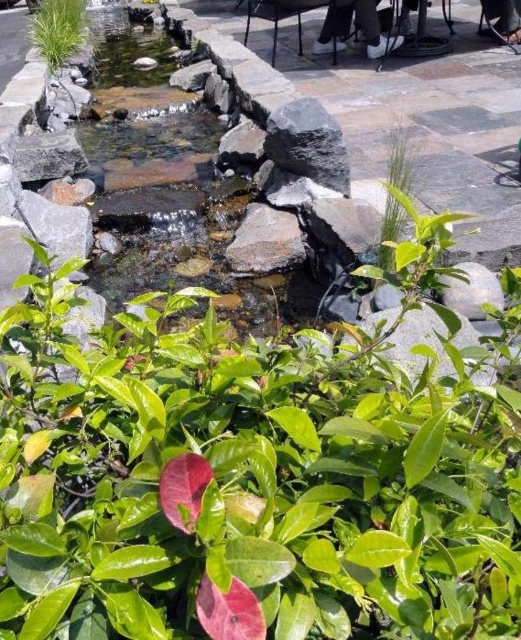
You are standing at the edge of the water feature and see the smooth gray rock at center and the white leather shoes at upper center. Which object is narrower in width?

The smooth gray rock at center is thinner than the white leather shoes at upper center, so the smooth gray rock at center is narrower in width.

You are standing in the outdoor water feature area and want to place a small decorative item between the smooth gray rock at center and the white leather shoes at upper center. Based on their positions, which object should you place the item closer to in order to ensure it is visible from your current viewpoint?

The smooth gray rock at center is closer to the viewer than the white leather shoes at upper center, so placing the item closer to the smooth gray rock at center would make it more visible from your current viewpoint.